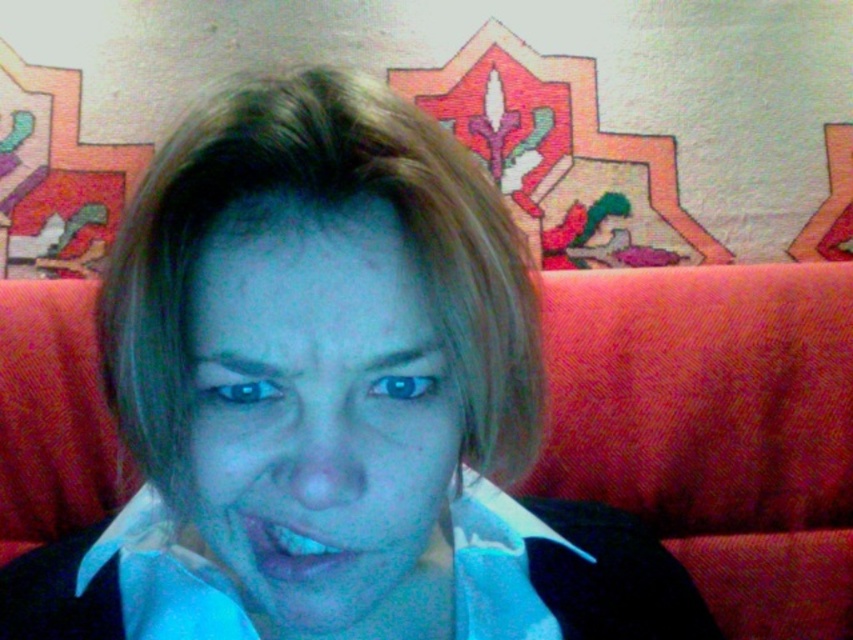
Question: Which object appears farthest from the camera in this image?

Choices:
 (A) blue matte face at center
 (B) blue glossy lips at center

Answer: (B)

Question: Is blue matte face at center further to the viewer compared to blue glossy lips at center?

Choices:
 (A) yes
 (B) no

Answer: (B)

Question: Which point is closer to the camera?

Choices:
 (A) (247, 524)
 (B) (273, 413)

Answer: (B)

Question: Is blue matte face at center below blue glossy lips at center?

Choices:
 (A) no
 (B) yes

Answer: (A)

Question: Does blue matte face at center appear on the right side of blue glossy lips at center?

Choices:
 (A) no
 (B) yes

Answer: (A)